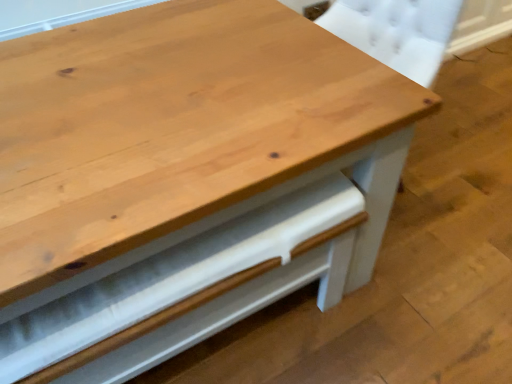
The width and height of the screenshot is (512, 384). What do you see at coordinates (188, 291) in the screenshot?
I see `white painted wood drawer at center` at bounding box center [188, 291].

In order to face white painted wood drawer at center, should I rotate leftwards or rightwards?

A 12.212 degree turn to the left will do.

The image size is (512, 384). In order to click on white painted wood drawer at center in this screenshot , I will do `click(188, 291)`.

Locate an element on the screen. The height and width of the screenshot is (384, 512). white painted wood drawer at center is located at coordinates (188, 291).